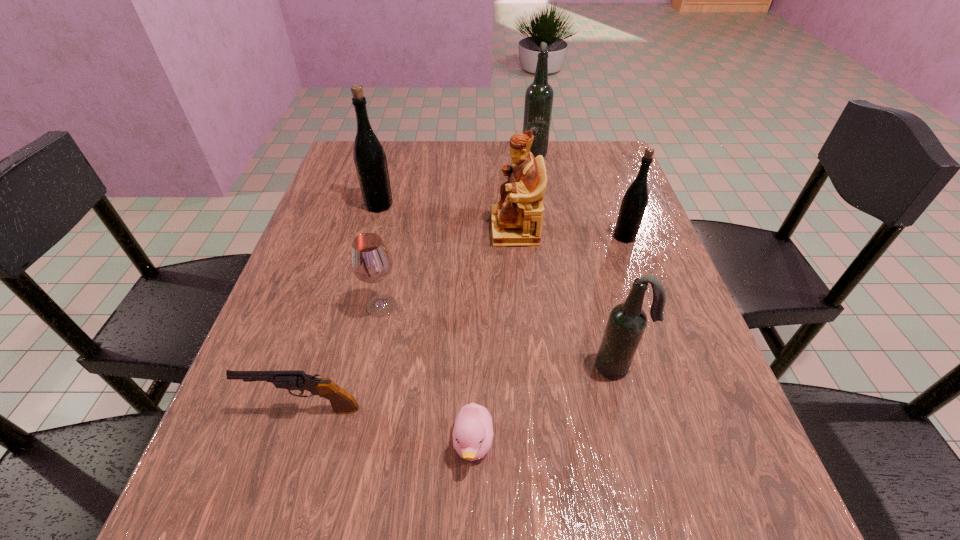
The width and height of the screenshot is (960, 540). I want to click on the fifth farthest object, so click(x=371, y=261).

Locate an element on the screen. black gun is located at coordinates (342, 402).

Find the location of a particular element. The height and width of the screenshot is (540, 960). gun is located at coordinates (342, 402).

Image resolution: width=960 pixels, height=540 pixels. What are the coordinates of `pink duckling` in the screenshot? It's located at (473, 431).

This screenshot has width=960, height=540. Find the location of `the fifth object from right to left`. the fifth object from right to left is located at coordinates (473, 431).

At what (x,y) coordinates should I click in order to perform the action: click on free space located 0.240m on the left of the farther dark beer bottle. Please return your answer as a coordinate pair (x, y). Looking at the image, I should click on (x=440, y=150).

Locate an element on the screen. This screenshot has width=960, height=540. free location located 0.330m on the right of the bigger green beer bottle is located at coordinates (524, 205).

I want to click on vacant space located 0.340m on the front-facing side of the figurine, so click(x=348, y=230).

What are the coordinates of `blank area located 0.210m on the front-facing side of the figurine` in the screenshot? It's located at (402, 230).

Find the location of a particular element. vacant point located on the front-facing side of the figurine is located at coordinates (398, 230).